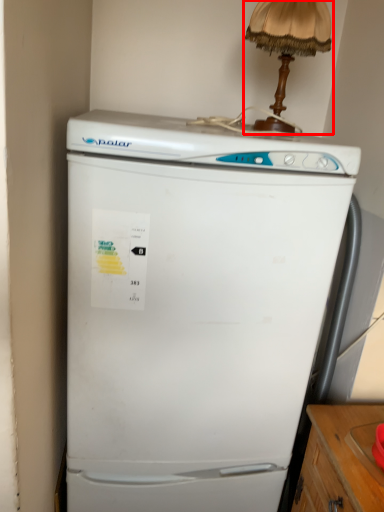
Question: From the image's perspective, where is table lamp (annotated by the red box) located relative to refrigerator?

Choices:
 (A) below
 (B) above

Answer: (B)